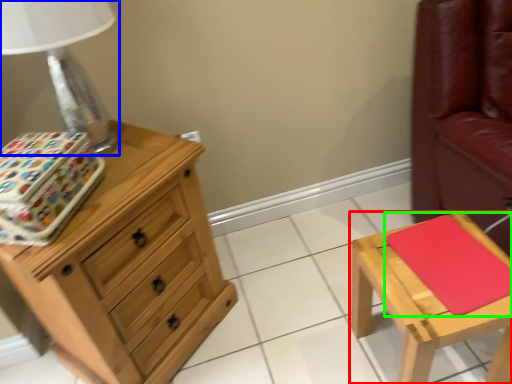
Question: Which is nearer to the stool (highlighted by a red box)? table lamp (highlighted by a blue box) or pad (highlighted by a green box).

Choices:
 (A) table lamp
 (B) pad

Answer: (B)